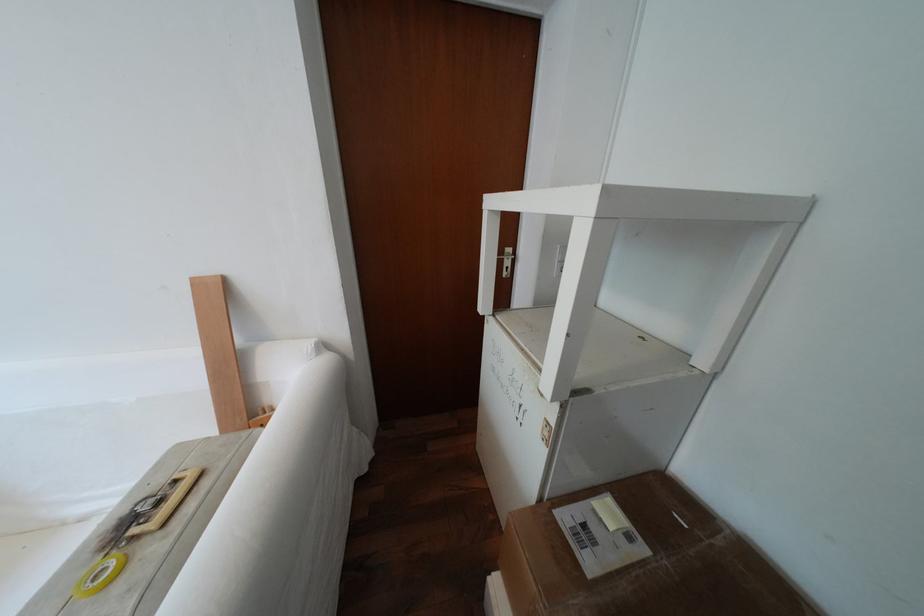
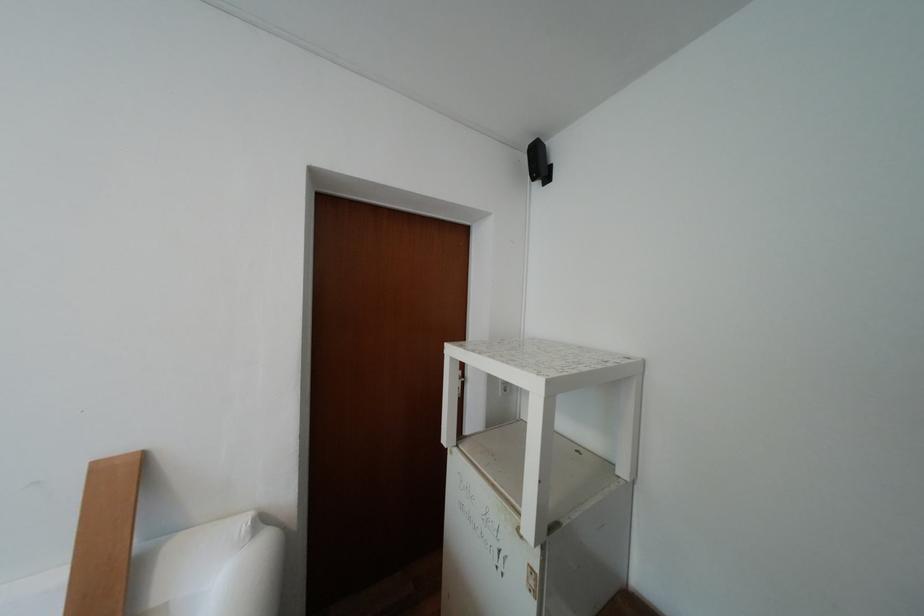
Where in the second image is the point corresponding to (x=208, y=284) from the first image?

(111, 468)